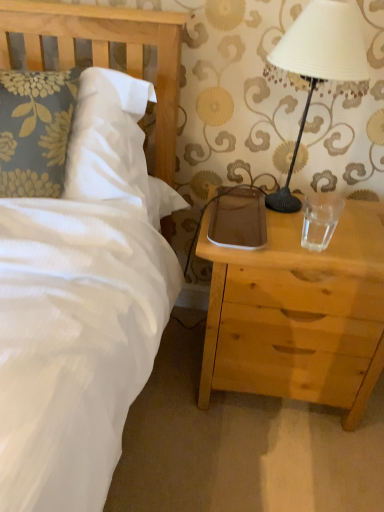
Image resolution: width=384 pixels, height=512 pixels. Identify the location of empty space that is ontop of light wood nightstand at right. (312, 224).